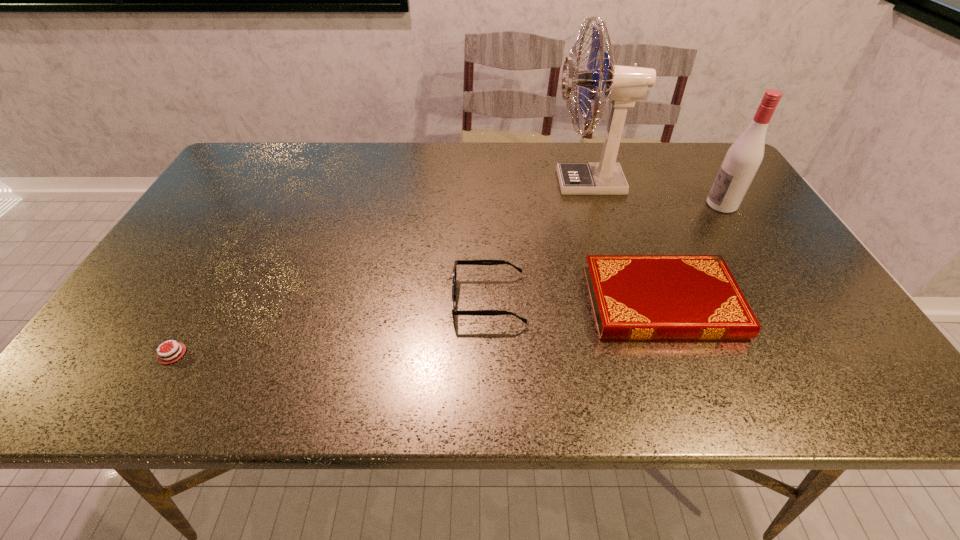
Identify the location of object that is the third nearest to the third shortest object. (168, 358).

Point out which object is positioned as the second nearest to the tallest object. Please provide its 2D coordinates. Your answer should be formatted as a tuple, i.e. [(x, y)], where the tuple contains the x and y coordinates of a point satisfying the conditions above.

[(634, 297)]

At what (x,y) coordinates should I click in order to perform the action: click on vacant space that satisfies the following two spatial constraints: 1. on the front-facing side of the tallest object; 2. on the front side of the leftmost object. Please return your answer as a coordinate pair (x, y). Looking at the image, I should click on (639, 354).

I want to click on free space that satisfies the following two spatial constraints: 1. on the front-facing side of the fan; 2. on the front side of the leftmost object, so click(639, 354).